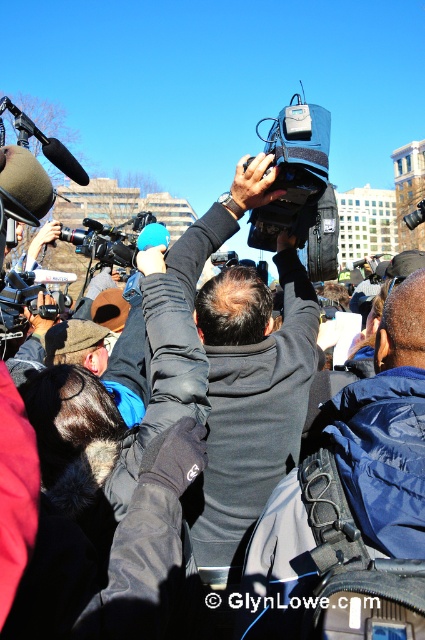
Question: Which object appears closest to the camera in this image?

Choices:
 (A) black plastic video camera at upper left
 (B) black matte video camera at upper center

Answer: (B)

Question: Among these points, which one is nearest to the camera?

Choices:
 (A) (136, 252)
 (B) (320, 145)

Answer: (B)

Question: Is black matte video camera at upper center smaller than black plastic video camera at upper left?

Choices:
 (A) yes
 (B) no

Answer: (B)

Question: Is black matte video camera at upper center bigger than black plastic video camera at upper left?

Choices:
 (A) no
 (B) yes

Answer: (B)

Question: Observing the image, what is the correct spatial positioning of black matte video camera at upper center in reference to black plastic video camera at upper left?

Choices:
 (A) below
 (B) above

Answer: (B)